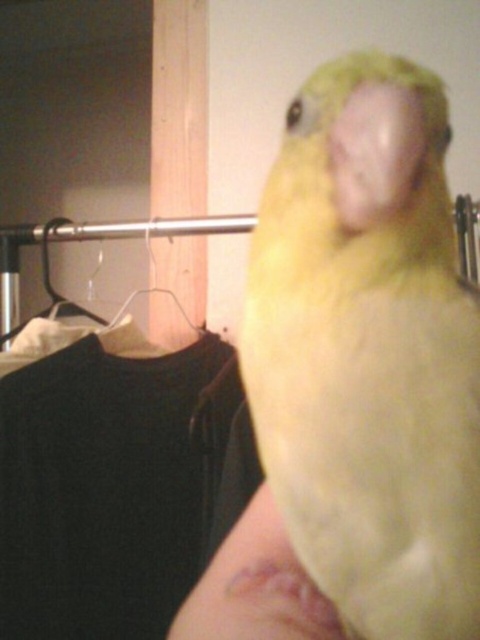
You are a photographer adjusting the focus on your camera. The yellow matte parrot at center and the pink flesh at center are both in your frame. If you want to ensure both subjects are in focus, what is the minimum distance you need to set your depth of field to?

The minimum depth of field required is at least 7.34 inches to ensure both the yellow matte parrot at center and the pink flesh at center are in focus.

You are a photographer trying to capture the yellow matte parrot at center and the pink flesh at center in a clear photo. Which object should you focus on to ensure the parrot is sharp while the other remains in the background?

The yellow matte parrot at center is in front of the pink flesh at center, so focusing on the yellow matte parrot at center will keep it sharp while the pink flesh at center blurs in the background.

You are an interior designer working on a project. You need to place a decorative item at the exact location of the point marked as point (369, 353). What object should you place there based on the scene?

You should place a yellow matte parrot at center at the point (369, 353) because the Objects Description states that this point indicates the location of the yellow matte parrot at center.